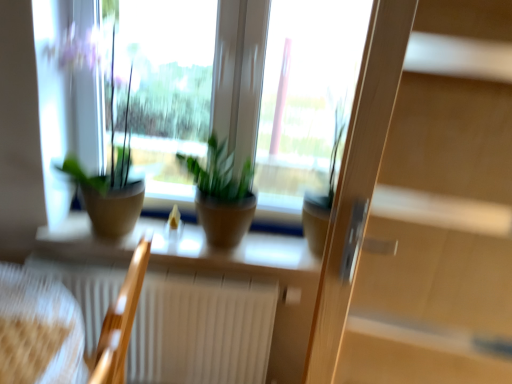
Question: Which direction should I rotate to face green matte plant at center, which ranks as the third houseplant in left-to-right order, — up or down?

Choices:
 (A) down
 (B) up

Answer: (A)

Question: From a real-world perspective, is wooden screen door at right on top of wooden armchair at lower left, the 2th armchair in the left-to-right sequence?

Choices:
 (A) yes
 (B) no

Answer: (A)

Question: From a real-world perspective, is wooden screen door at right below wooden armchair at lower left, the 2th armchair in the left-to-right sequence?

Choices:
 (A) no
 (B) yes

Answer: (A)

Question: Considering the relative sizes of wooden screen door at right and wooden armchair at lower left, the 2th armchair in the left-to-right sequence, in the image provided, is wooden screen door at right thinner than wooden armchair at lower left, the 2th armchair in the left-to-right sequence,?

Choices:
 (A) no
 (B) yes

Answer: (B)

Question: Is wooden screen door at right oriented towards wooden armchair at lower left, the 2th armchair in the left-to-right sequence?

Choices:
 (A) no
 (B) yes

Answer: (A)

Question: Does wooden screen door at right lie in front of wooden armchair at lower left, the first armchair from the right?

Choices:
 (A) yes
 (B) no

Answer: (A)

Question: Is wooden screen door at right positioned behind wooden armchair at lower left, the 2th armchair in the left-to-right sequence?

Choices:
 (A) yes
 (B) no

Answer: (B)

Question: Is green matte plant at center, the 2th houseplant when ordered from left to right, surrounded by wooden armchair at lower left, the first armchair from the right?

Choices:
 (A) yes
 (B) no

Answer: (B)

Question: Is wooden armchair at lower left, the 2th armchair in the left-to-right sequence, closer to the viewer compared to green matte plant at center, the 2th houseplant when ordered from left to right?

Choices:
 (A) no
 (B) yes

Answer: (B)

Question: From the image's perspective, would you say wooden armchair at lower left, the first armchair from the right, is positioned over green matte plant at center, the 2th houseplant when ordered from left to right?

Choices:
 (A) no
 (B) yes

Answer: (A)

Question: Does wooden armchair at lower left, the first armchair from the right, have a lesser width compared to green matte plant at center, the 2th houseplant when ordered from left to right?

Choices:
 (A) no
 (B) yes

Answer: (B)

Question: Is wooden armchair at lower left, the first armchair from the right, shorter than green matte plant at center, the 2th houseplant when ordered from left to right?

Choices:
 (A) no
 (B) yes

Answer: (A)

Question: Considering the relative sizes of wooden armchair at lower left, the 2th armchair in the left-to-right sequence, and green matte plant at center, marked as the second houseplant in a right-to-left arrangement, in the image provided, is wooden armchair at lower left, the 2th armchair in the left-to-right sequence, bigger than green matte plant at center, marked as the second houseplant in a right-to-left arrangement,?

Choices:
 (A) yes
 (B) no

Answer: (A)

Question: From a real-world perspective, is green matte plant at center, the first houseplant from the right, physically above wooden armchair at lower left, the first armchair viewed from the left?

Choices:
 (A) no
 (B) yes

Answer: (B)